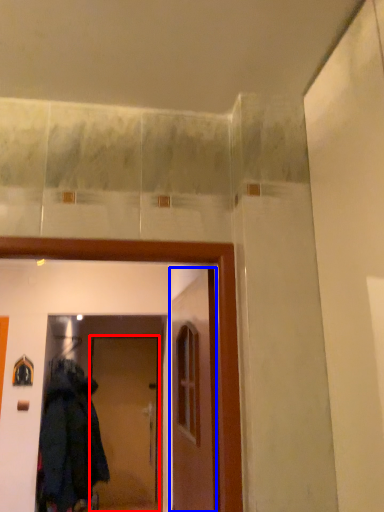
Question: Which of the following is the farthest to the observer, door (highlighted by a red box) or door (highlighted by a blue box)?

Choices:
 (A) door
 (B) door

Answer: (A)